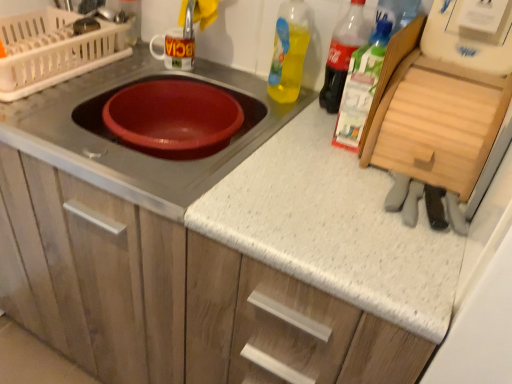
Question: From a real-world perspective, is matte plastic dish drainer at upper left positioned over matte red bowl at center based on gravity?

Choices:
 (A) no
 (B) yes

Answer: (B)

Question: Is matte red bowl at center located within matte plastic dish drainer at upper left?

Choices:
 (A) yes
 (B) no

Answer: (B)

Question: Is matte plastic dish drainer at upper left smaller than matte red bowl at center?

Choices:
 (A) yes
 (B) no

Answer: (A)

Question: Is matte plastic dish drainer at upper left bigger than matte red bowl at center?

Choices:
 (A) yes
 (B) no

Answer: (B)

Question: Is there a large distance between matte plastic dish drainer at upper left and matte red bowl at center?

Choices:
 (A) no
 (B) yes

Answer: (A)

Question: Is matte plastic dish drainer at upper left at the right side of matte red bowl at center?

Choices:
 (A) yes
 (B) no

Answer: (B)

Question: Is matte white cabinet at center to the right of translucent plastic bottle at upper right, arranged as the 2th bottle when viewed from the left, from the viewer's perspective?

Choices:
 (A) yes
 (B) no

Answer: (B)

Question: Could you tell me if matte white cabinet at center is facing translucent plastic bottle at upper right, arranged as the 2th bottle when viewed from the left?

Choices:
 (A) no
 (B) yes

Answer: (A)

Question: From the image's perspective, does matte white cabinet at center appear lower than translucent plastic bottle at upper right, positioned as the second bottle in right-to-left order?

Choices:
 (A) no
 (B) yes

Answer: (B)

Question: From a real-world perspective, is matte white cabinet at center positioned under translucent plastic bottle at upper right, arranged as the 2th bottle when viewed from the left, based on gravity?

Choices:
 (A) no
 (B) yes

Answer: (B)

Question: Is matte white cabinet at center facing away from translucent plastic bottle at upper right, arranged as the 2th bottle when viewed from the left?

Choices:
 (A) yes
 (B) no

Answer: (B)

Question: Does matte white cabinet at center have a greater width compared to translucent plastic bottle at upper right, positioned as the second bottle in right-to-left order?

Choices:
 (A) yes
 (B) no

Answer: (A)

Question: Is matte plastic dish drainer at upper left further to camera compared to translucent plastic bottle at upper right, which is the first bottle from right to left?

Choices:
 (A) yes
 (B) no

Answer: (A)